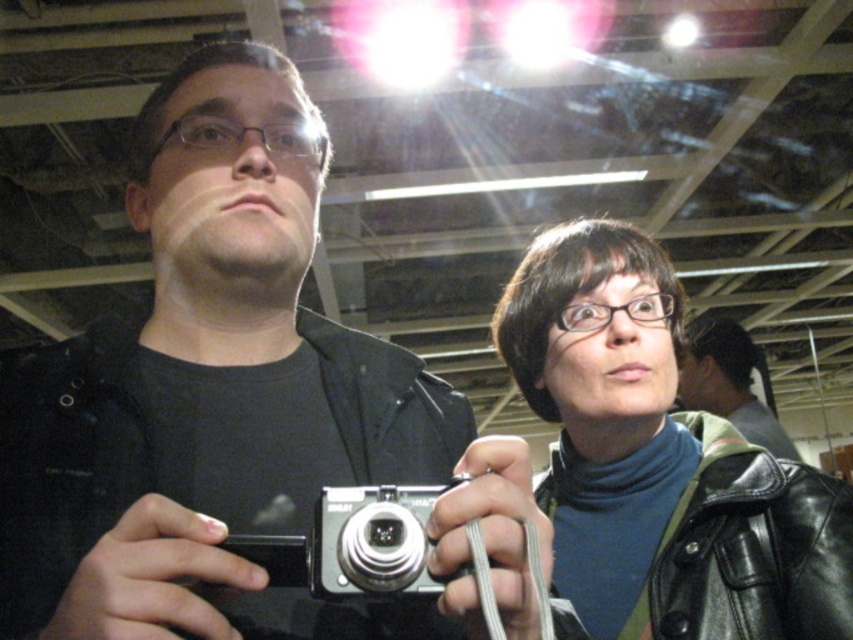
Question: Which point is farther to the camera?

Choices:
 (A) black leather jacket at upper right
 (B) silver metallic camera at center

Answer: (A)

Question: Does black leather jacket at upper right lie behind silver metallic camera at center?

Choices:
 (A) no
 (B) yes

Answer: (B)

Question: Is black leather jacket at upper right positioned at the back of silver metallic camera at center?

Choices:
 (A) no
 (B) yes

Answer: (B)

Question: Which point appears farthest from the camera in this image?

Choices:
 (A) (514, 298)
 (B) (447, 580)

Answer: (A)

Question: Is black leather jacket at upper right closer to camera compared to silver metallic camera at center?

Choices:
 (A) no
 (B) yes

Answer: (A)

Question: Which object appears closest to the camera in this image?

Choices:
 (A) silver metallic camera at center
 (B) black leather jacket at upper right

Answer: (A)